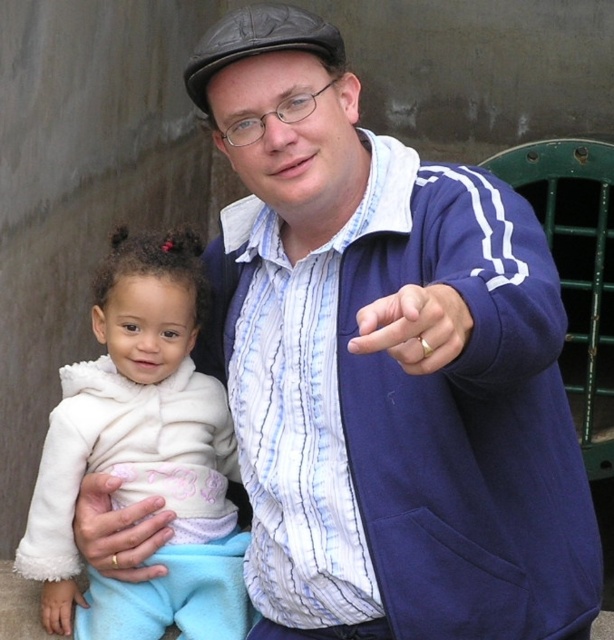
Is blue fleece jacket at center positioned behind gold ring at center?

Yes, it is behind gold ring at center.

This screenshot has height=640, width=614. What are the coordinates of `blue fleece jacket at center` in the screenshot? It's located at (410, 410).

Which is in front, point (556, 404) or point (426, 355)?

Positioned in front is point (426, 355).

Locate an element on the screen. blue fleece jacket at center is located at coordinates (410, 410).

Is blue fleece jacket at center positioned in front of white fluffy coat at left?

Yes, it is.

Between blue fleece jacket at center and white fluffy coat at left, which one appears on the right side from the viewer's perspective?

Positioned to the right is blue fleece jacket at center.

What do you see at coordinates (410, 410) in the screenshot?
I see `blue fleece jacket at center` at bounding box center [410, 410].

You are a GUI agent. You are given a task and a screenshot of the screen. Output one action in this format:
    pyautogui.click(x=<x>, y=<y>)
    Task: Click on the blue fleece jacket at center
    
    Given the screenshot: What is the action you would take?
    point(410,410)

Which is in front, point (64, 420) or point (142, 541)?

Positioned in front is point (142, 541).

Is point (53, 493) less distant than point (82, 484)?

Yes, point (53, 493) is in front of point (82, 484).

The width and height of the screenshot is (614, 640). I want to click on white fluffy coat at left, so click(x=142, y=454).